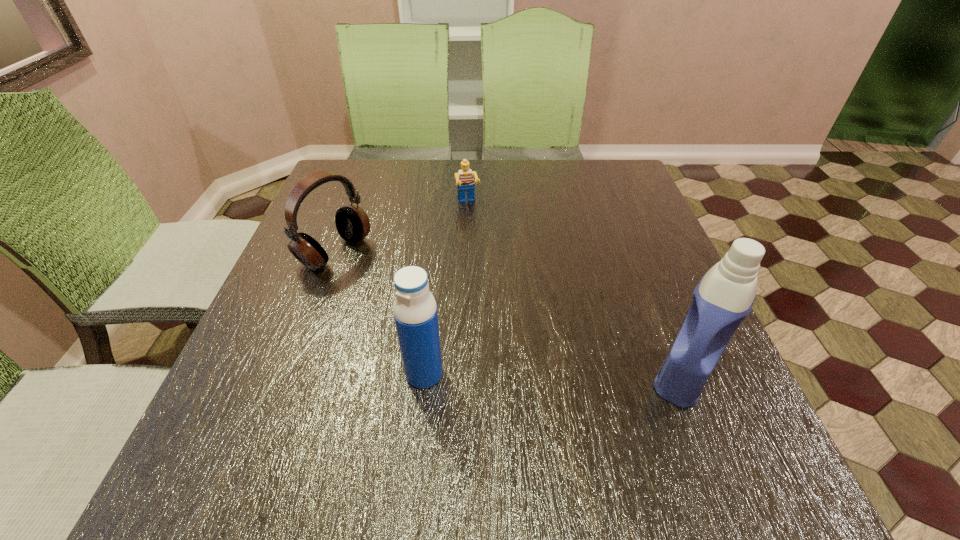
In order to click on free space that satisfies the following two spatial constraints: 1. on the front side of the tallest object; 2. on the right side of the Lego in this screenshot , I will do `click(462, 375)`.

At what (x,y) coordinates should I click in order to perform the action: click on vacant space that satisfies the following two spatial constraints: 1. on the front side of the detergent; 2. on the right side of the water bottle. Please return your answer as a coordinate pair (x, y). The image size is (960, 540). Looking at the image, I should click on (424, 375).

This screenshot has height=540, width=960. Find the location of `vacant position in the image that satisfies the following two spatial constraints: 1. on the front side of the second object from right to left; 2. on the right side of the rightmost object`. vacant position in the image that satisfies the following two spatial constraints: 1. on the front side of the second object from right to left; 2. on the right side of the rightmost object is located at coordinates (462, 375).